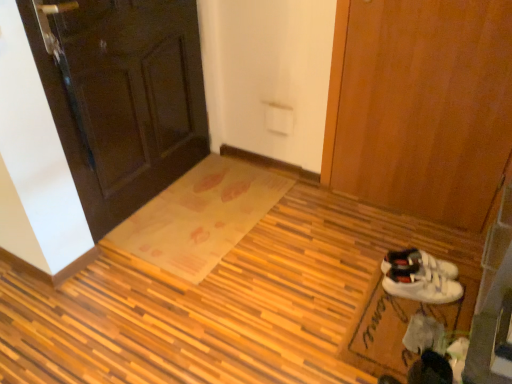
Question: Does dark wood door at upper left, the 1th door from the left, contain translucent plastic doormat at center, the 1th doormat when ordered from left to right?

Choices:
 (A) yes
 (B) no

Answer: (B)

Question: Does dark wood door at upper left, the 1th door from the left, touch translucent plastic doormat at center, the 2th doormat in the front-to-back sequence?

Choices:
 (A) no
 (B) yes

Answer: (A)

Question: Is translucent plastic doormat at center, placed as the second doormat when sorted from right to left, at the back of dark wood door at upper left, the 1th door from the left?

Choices:
 (A) yes
 (B) no

Answer: (B)

Question: Is dark wood door at upper left, the 1th door from the left, in front of translucent plastic doormat at center, the 1th doormat when ordered from left to right?

Choices:
 (A) yes
 (B) no

Answer: (A)

Question: Does dark wood door at upper left, placed as the second door when sorted from right to left, come behind translucent plastic doormat at center, the 2th doormat in the front-to-back sequence?

Choices:
 (A) yes
 (B) no

Answer: (B)

Question: Is white fabric doormat at lower right, arranged as the 2th doormat when viewed from the left, in front of or behind translucent plastic doormat at center, the 2th doormat in the front-to-back sequence, in the image?

Choices:
 (A) front
 (B) behind

Answer: (A)

Question: In terms of width, does white fabric doormat at lower right, which is the first doormat in right-to-left order, look wider or thinner when compared to translucent plastic doormat at center, placed as the second doormat when sorted from right to left?

Choices:
 (A) wide
 (B) thin

Answer: (B)

Question: From their relative heights in the image, would you say white fabric doormat at lower right, which ranks as the second doormat in back-to-front order, is taller or shorter than translucent plastic doormat at center, placed as the second doormat when sorted from right to left?

Choices:
 (A) short
 (B) tall

Answer: (A)

Question: Is point (449, 271) positioned closer to the camera than point (177, 190)?

Choices:
 (A) farther
 (B) closer

Answer: (B)

Question: Considering the positions of wooden mat at center and translucent plastic doormat at center, which ranks as the 1th doormat in back-to-front order, in the image, is wooden mat at center taller or shorter than translucent plastic doormat at center, which ranks as the 1th doormat in back-to-front order,?

Choices:
 (A) short
 (B) tall

Answer: (B)

Question: Based on their positions, is wooden mat at center located to the left or right of translucent plastic doormat at center, placed as the second doormat when sorted from right to left?

Choices:
 (A) right
 (B) left

Answer: (A)

Question: Looking at their shapes, would you say wooden mat at center is wider or thinner than translucent plastic doormat at center, which ranks as the 1th doormat in back-to-front order?

Choices:
 (A) thin
 (B) wide

Answer: (B)

Question: In the image, is wooden mat at center positioned in front of or behind translucent plastic doormat at center, the 1th doormat when ordered from left to right?

Choices:
 (A) front
 (B) behind

Answer: (A)

Question: Is translucent plastic doormat at center, placed as the second doormat when sorted from right to left, in front of or behind dark wood door at upper left, placed as the second door when sorted from right to left, in the image?

Choices:
 (A) front
 (B) behind

Answer: (B)

Question: Considering the positions of point (138, 235) and point (55, 112), is point (138, 235) closer or farther from the camera than point (55, 112)?

Choices:
 (A) farther
 (B) closer

Answer: (A)